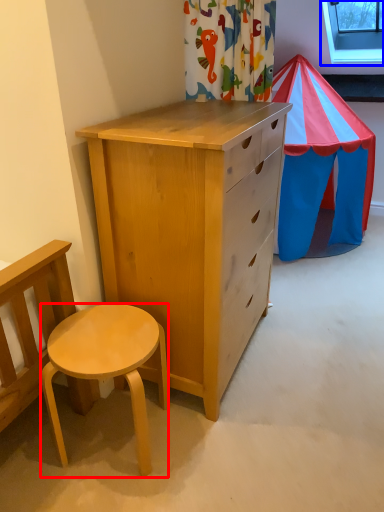
Question: Which object is closer to the camera taking this photo, desk (highlighted by a red box) or window screen (highlighted by a blue box)?

Choices:
 (A) desk
 (B) window screen

Answer: (A)